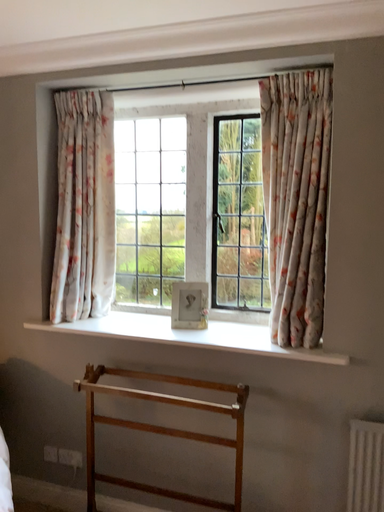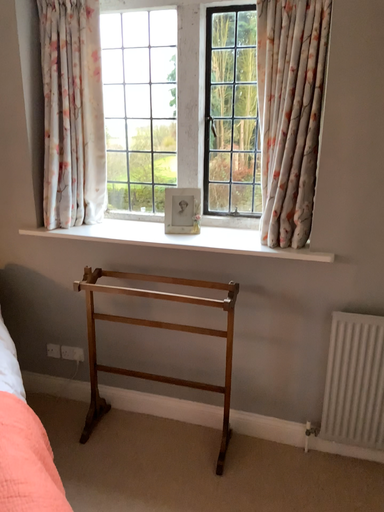
Question: How did the camera likely rotate when shooting the video?

Choices:
 (A) rotated upward
 (B) rotated downward

Answer: (B)